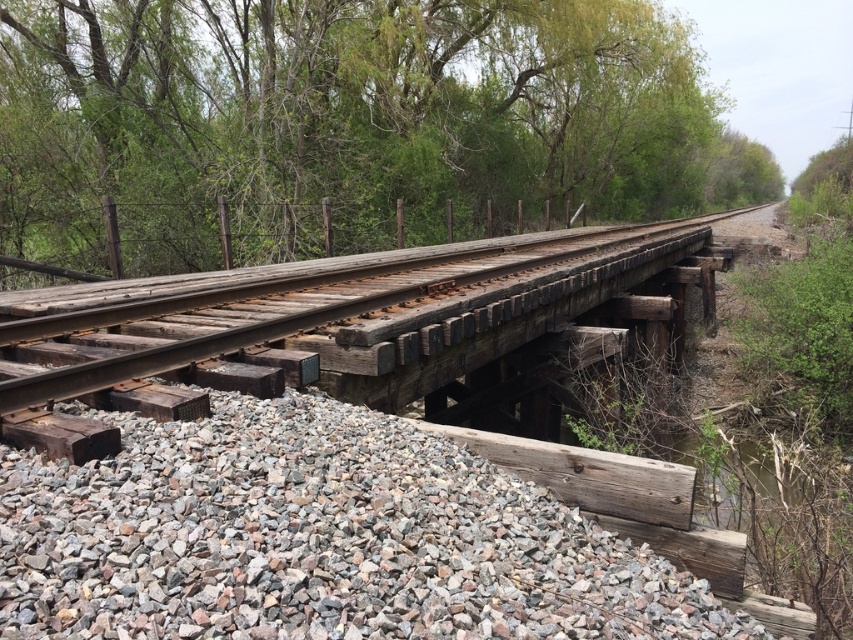
You are a landscape architect designing a pathway near the railway bridge. You have two materials to choose from for the pathway surface. The gray gravel at lower left and the rusty metal rail at center. If you want the pathway to be wider, which material should you select?

The rusty metal rail at center is wider than the gray gravel at lower left, so you should select the rusty metal rail at center for a wider pathway.

You are a hiker standing on the railway bridge and want to take a photo of the green leafy tree at center and the rusty metal rail at center. Which object should you focus on first if you want to capture both in the frame without moving the camera?

The green leafy tree at center is to the right of the rusty metal rail at center. Since they are positioned side by side, you can focus on either one first as long as your camera frame includes both.

You are standing on the railway bridge and want to take a photo of both the point at coordinates point (x=688, y=148) and point (x=383, y=548). Which point will appear closer to the bottom edge of your camera viewfinder?

Point (x=383, y=548) will appear closer to the bottom edge of the camera viewfinder because it is closer to the camera than point (x=688, y=148).